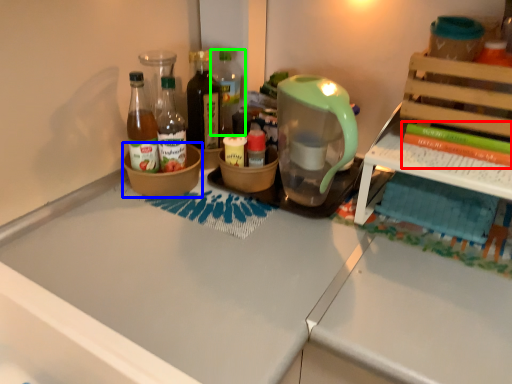
Question: Which is nearer to the book (highlighted by a red box)? bowl (highlighted by a blue box) or bottle (highlighted by a green box).

Choices:
 (A) bowl
 (B) bottle

Answer: (B)